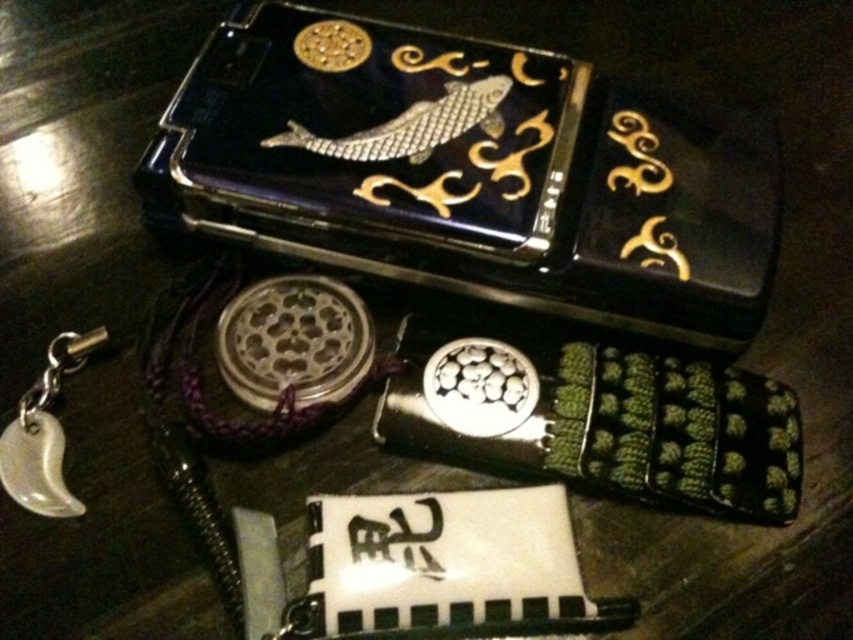
Find the location of a particular element. This screenshot has height=640, width=853. black lacquer box at upper center is located at coordinates (473, 172).

Is point (595, 273) in front of point (41, 458)?

No, (595, 273) is behind (41, 458).

Locate an element on the screen. This screenshot has width=853, height=640. black lacquer box at upper center is located at coordinates [x=473, y=172].

In order to click on black lacquer box at upper center in this screenshot , I will do `click(473, 172)`.